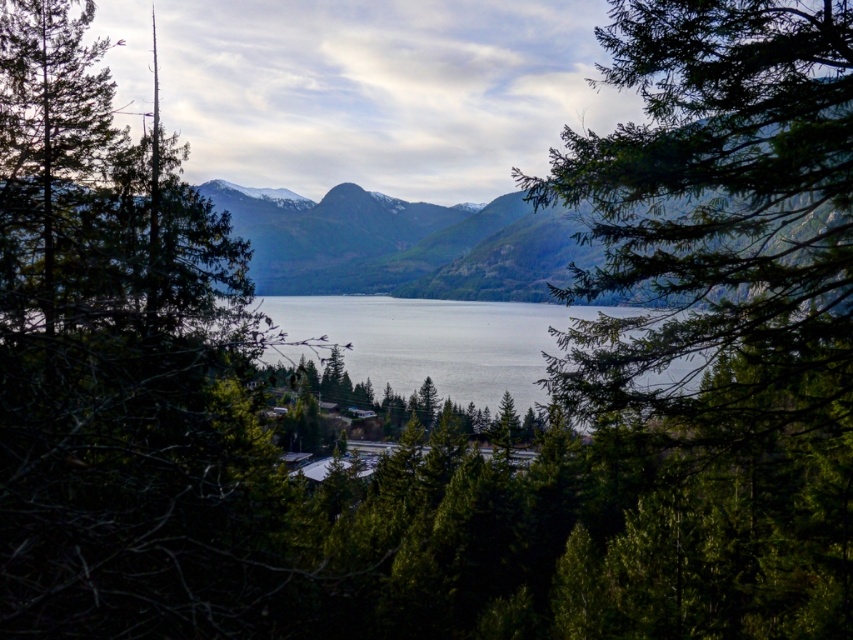
You are standing at point (x=402, y=244) in the image. What is the most prominent object you see?

The most prominent object at point (x=402, y=244) is the green textured mountain at center.